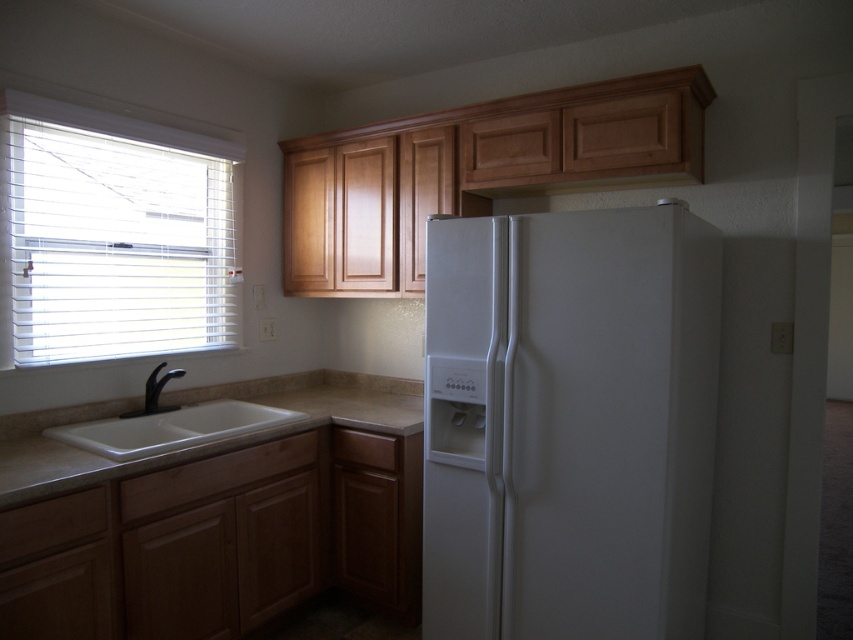
Who is more distant from viewer, (39,116) or (154,378)?

Point (154,378)

Who is higher up, white blinds at left or black matte faucet at sink left?

white blinds at left is higher up.

Between point (152, 348) and point (183, 371), which one is positioned behind?

The point (152, 348) is behind.

I want to click on white blinds at left, so tap(113, 234).

Can you confirm if white matte refrigerator at center is positioned below white ceramic sink at lower left?

Yes, white matte refrigerator at center is below white ceramic sink at lower left.

Between white matte refrigerator at center and white ceramic sink at lower left, which one is positioned higher?

white ceramic sink at lower left

Who is more distant from viewer, (463, 547) or (161, 445)?

The point (463, 547) is more distant.

Find the location of a particular element. This screenshot has height=640, width=853. white matte refrigerator at center is located at coordinates (569, 422).

Between white matte refrigerator at center and beige granite countertop at lower left, which one appears on the right side from the viewer's perspective?

Positioned to the right is white matte refrigerator at center.

Between white matte refrigerator at center and beige granite countertop at lower left, which one appears on the left side from the viewer's perspective?

beige granite countertop at lower left

Find the location of `white matte refrigerator at center`. white matte refrigerator at center is located at coordinates (569, 422).

Locate an element on the screen. white matte refrigerator at center is located at coordinates (569, 422).